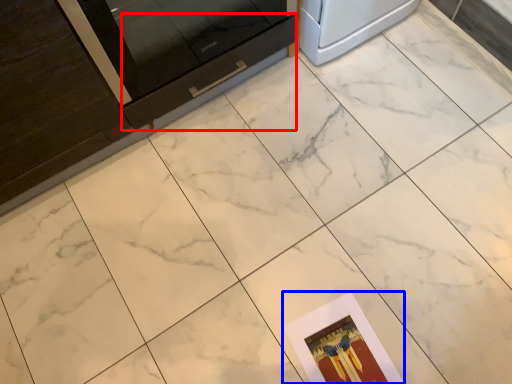
Question: Which of the following is the closest to the observer, drawer (highlighted by a red box) or postcard (highlighted by a blue box)?

Choices:
 (A) drawer
 (B) postcard

Answer: (A)